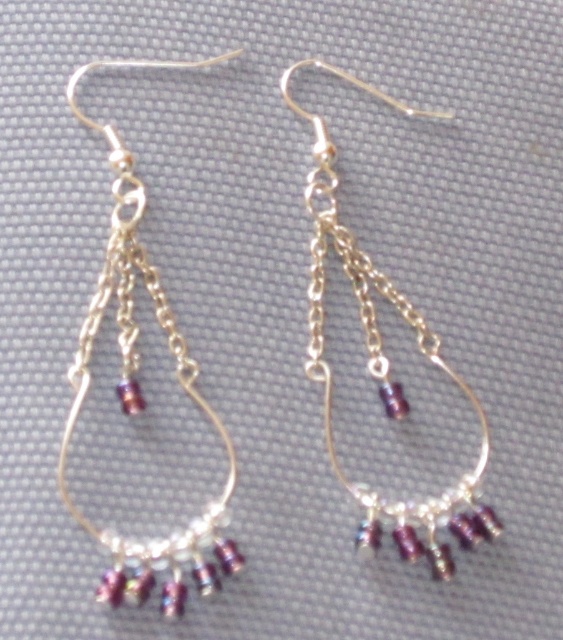
Question: Which point appears closest to the camera in this image?

Choices:
 (A) (169, 566)
 (B) (356, 298)

Answer: (A)

Question: Is the position of matte silver chain at left more distant than that of silver/golden chain earrings at center?

Choices:
 (A) yes
 (B) no

Answer: (B)

Question: Is matte silver chain at left wider than silver/golden chain earrings at center?

Choices:
 (A) no
 (B) yes

Answer: (A)

Question: Can you confirm if matte silver chain at left is positioned to the right of silver/golden chain earrings at center?

Choices:
 (A) yes
 (B) no

Answer: (B)

Question: Which of the following is the closest to the observer?

Choices:
 (A) silver/golden chain earrings at center
 (B) matte silver chain at left

Answer: (B)